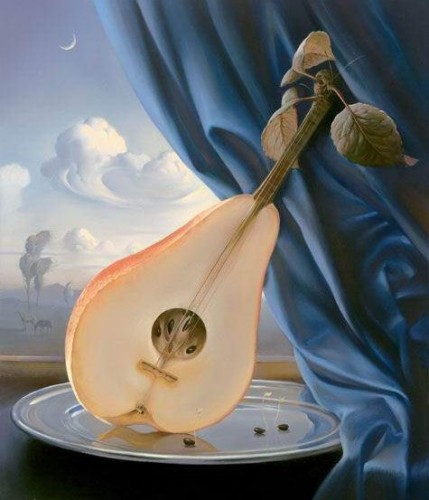
Identify the location of silver round plate. (229, 444).